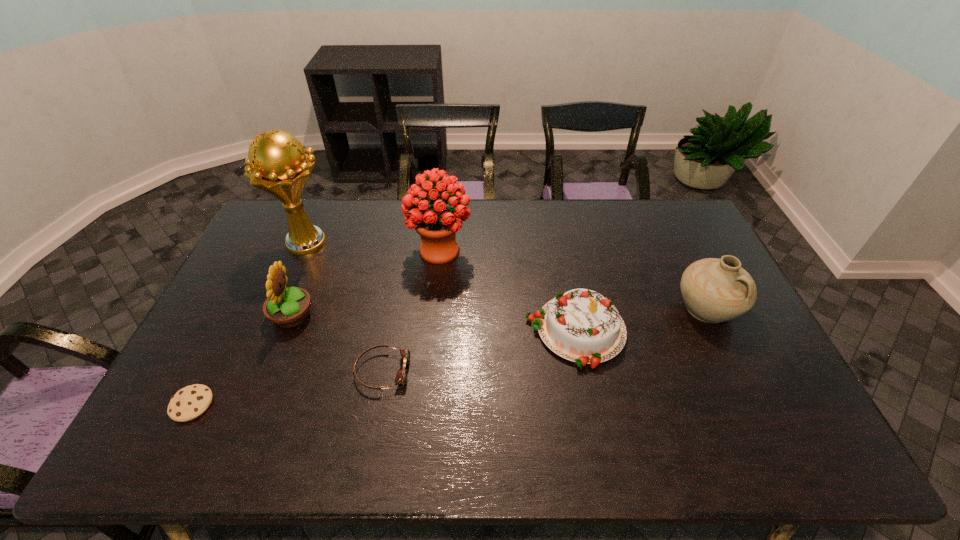
Where is `trophy_cup`? trophy_cup is located at coordinates (276, 163).

Locate an element on the screen. the sixth shortest object is located at coordinates (437, 224).

The height and width of the screenshot is (540, 960). I want to click on sunflower, so click(288, 307).

Locate an element on the screen. The height and width of the screenshot is (540, 960). pottery is located at coordinates (714, 290).

This screenshot has height=540, width=960. What are the coordinates of `cake` in the screenshot? It's located at (583, 326).

Identify the location of the second object from right to left. (583, 326).

At what (x,y) coordinates should I click in order to perform the action: click on the second shortest object. Please return your answer as a coordinate pair (x, y). Looking at the image, I should click on (401, 378).

The height and width of the screenshot is (540, 960). What are the coordinates of `the shortest object` in the screenshot? It's located at (190, 402).

Where is `free space located at the front of the trophy_cup where the globe is prominent`? free space located at the front of the trophy_cup where the globe is prominent is located at coordinates (434, 242).

At what (x,y) coordinates should I click in order to perform the action: click on free location located 0.080m on the front of the bouquet. Please return your answer as a coordinate pair (x, y). Looking at the image, I should click on point(436,290).